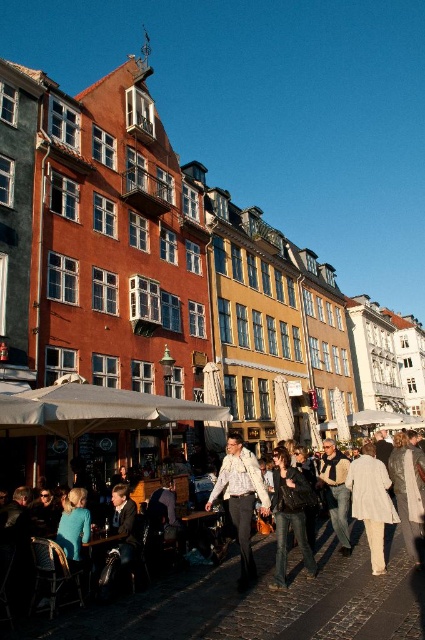
Question: Is denim jacket at lower center to the left of leather jacket at center from the viewer's perspective?

Choices:
 (A) yes
 (B) no

Answer: (A)

Question: Which of the following is the closest to the observer?

Choices:
 (A) (251, 556)
 (B) (218, 592)
 (C) (345, 506)
 (D) (312, 570)

Answer: (B)

Question: In this image, where is white textured shirt at center located relative to denim jeans at center?

Choices:
 (A) below
 (B) above

Answer: (A)

Question: Is white textured shirt at center to the left of leather jacket at center from the viewer's perspective?

Choices:
 (A) yes
 (B) no

Answer: (A)

Question: Estimate the real-world distances between objects in this image. Which object is closer to the denim jeans at center?

Choices:
 (A) light beige fabric coat at center
 (B) denim jacket at lower center
 (C) leather jacket at center
 (D) white textured shirt at center

Answer: (D)

Question: Estimate the real-world distances between objects in this image. Which object is closer to the denim jacket at lower center?

Choices:
 (A) white textured shirt at center
 (B) leather jacket at center

Answer: (A)